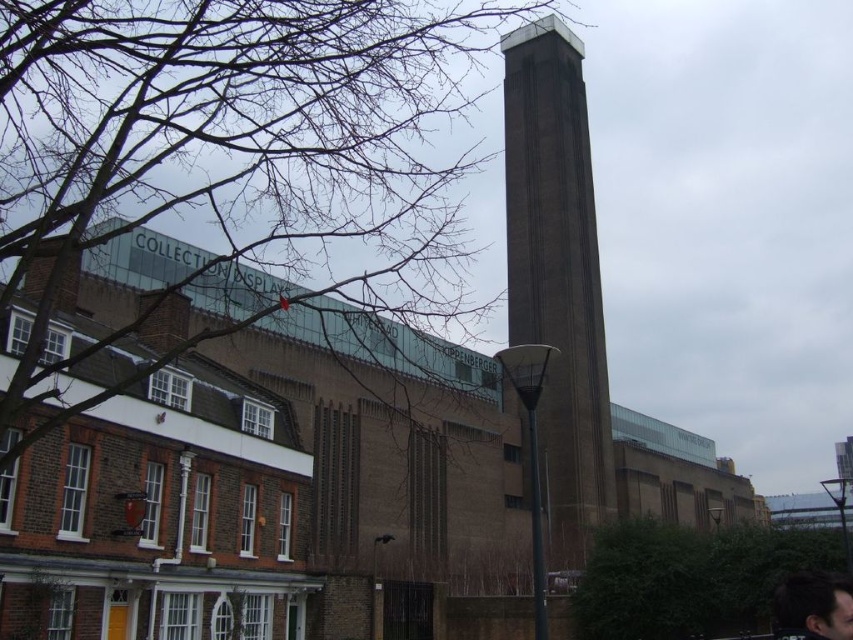
Question: Is brown brick tower at center below dark brown hair at lower right?

Choices:
 (A) yes
 (B) no

Answer: (B)

Question: Does brown brick tower at center appear over dark brown hair at lower right?

Choices:
 (A) no
 (B) yes

Answer: (B)

Question: Which object appears closest to the camera in this image?

Choices:
 (A) brown brick tower at center
 (B) dark brown hair at lower right

Answer: (B)

Question: Does brown brick tower at center appear under dark brown hair at lower right?

Choices:
 (A) no
 (B) yes

Answer: (A)